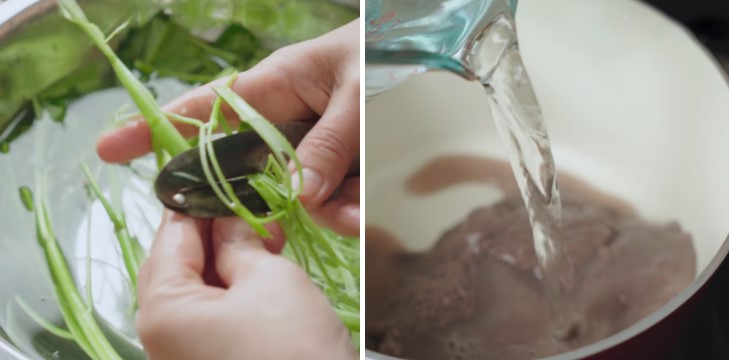
What are the coordinates of `plant` in the screenshot? It's located at (264, 21).